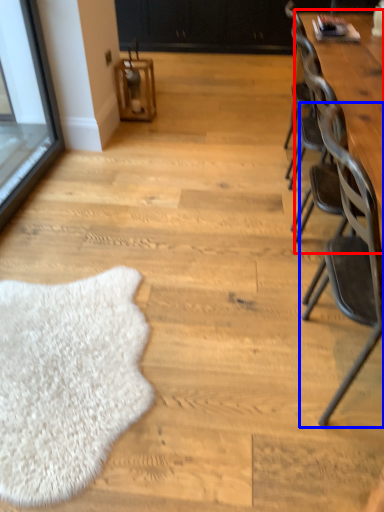
Question: Among these objects, which one is nearest to the camera, table (highlighted by a red box) or chair (highlighted by a blue box)?

Choices:
 (A) table
 (B) chair

Answer: (B)